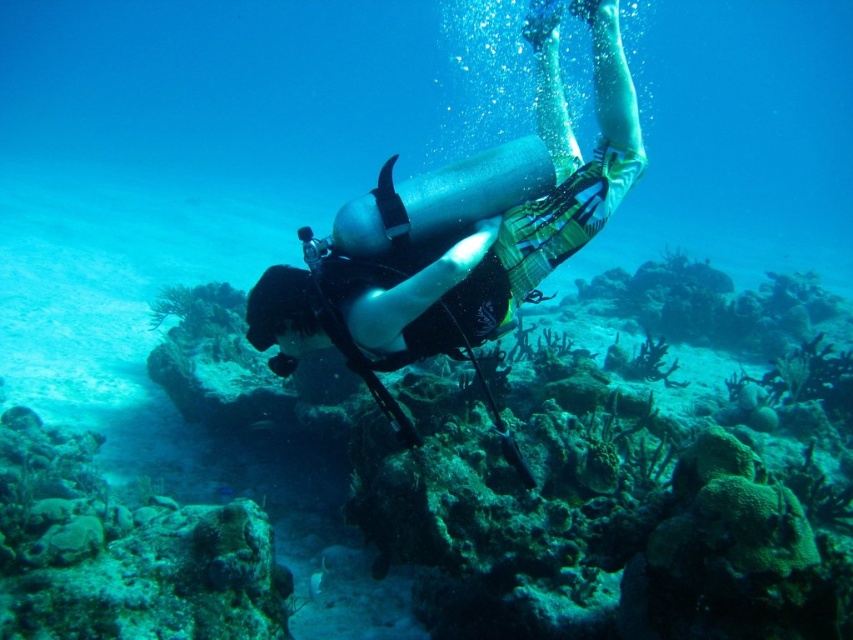
You are a marine biologist observing the underwater scene. You need to determine which object occupies more space in the image between the green coral reef at center and the silver metallic scuba diver at center. Based on the scene description, which one is bigger?

The green coral reef at center is larger in size than the silver metallic scuba diver at center according to the description.

You are a marine biologist observing the underwater scene. You notice the green coral reef at center and the silver metallic scuba diver at center. Which object is located to the left of the other?

The green coral reef at center is positioned on the left side of the silver metallic scuba diver at center.

You are a marine biologist planning to take a sample from the green coral reef at center while observing the silver metallic scuba diver at center. Given that your collection tool has a maximum reach of 5 feet, can you safely collect the sample without moving closer?

The distance between the green coral reef at center and the silver metallic scuba diver at center is 5.82 feet, which exceeds the 5 feet reach of the collection tool. Therefore, you cannot safely collect the sample without moving closer.